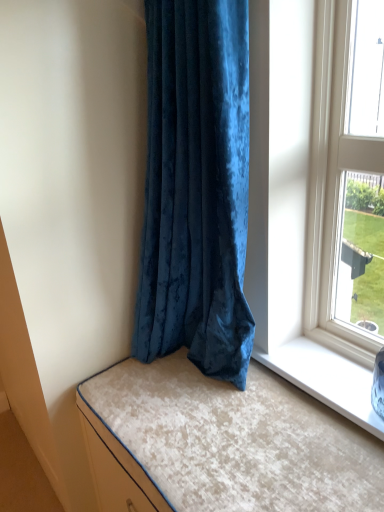
Question: In terms of height, does velvet beige cushion at lower left look taller or shorter compared to velvet blue curtain at center?

Choices:
 (A) short
 (B) tall

Answer: (A)

Question: Is point (168, 371) closer or farther from the camera than point (210, 339)?

Choices:
 (A) closer
 (B) farther

Answer: (B)

Question: From the image's perspective, is velvet beige cushion at lower left located above or below velvet blue curtain at center?

Choices:
 (A) below
 (B) above

Answer: (A)

Question: Looking at their shapes, would you say velvet blue curtain at center is wider or thinner than velvet beige cushion at lower left?

Choices:
 (A) thin
 (B) wide

Answer: (A)

Question: From a real-world perspective, is velvet blue curtain at center above or below velvet beige cushion at lower left?

Choices:
 (A) below
 (B) above

Answer: (B)

Question: Looking at the image, does velvet blue curtain at center seem bigger or smaller compared to velvet beige cushion at lower left?

Choices:
 (A) small
 (B) big

Answer: (B)

Question: From the image's perspective, is velvet blue curtain at center located above or below velvet beige cushion at lower left?

Choices:
 (A) above
 (B) below

Answer: (A)